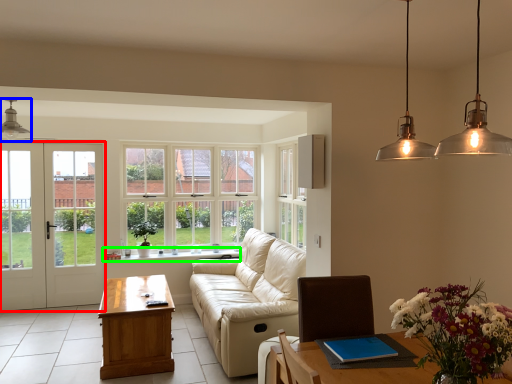
Question: Which object is the closest to the door (highlighted by a red box)? Choose among these: light fixture (highlighted by a blue box) or window sill (highlighted by a green box).

Choices:
 (A) light fixture
 (B) window sill

Answer: (B)